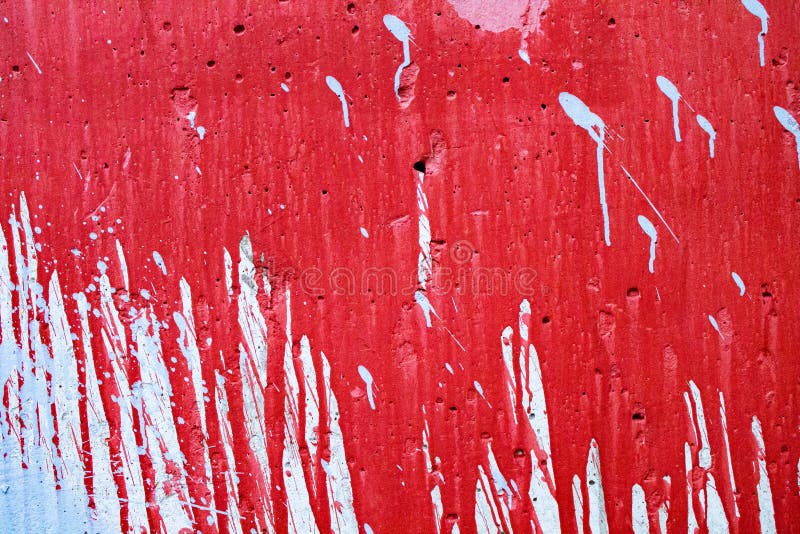
Locate an element on the screen. The image size is (800, 534). white wall is located at coordinates (30, 509), (58, 420), (130, 517), (170, 506), (302, 508), (346, 501), (494, 519), (548, 515), (596, 521).